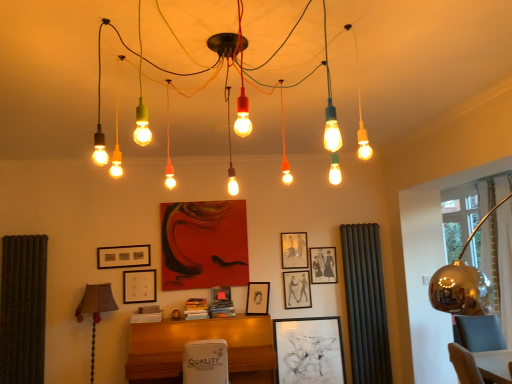
Question: Is the depth of matte black picture frame at center, positioned as the third picture frame in right-to-left order, greater than that of matte black picture frame at center, which ranks as the 5th picture frame in left-to-right order?

Choices:
 (A) yes
 (B) no

Answer: (A)

Question: Would you say matte black picture frame at center, which ranks as the 5th picture frame in left-to-right order, is part of matte black picture frame at center, the 7th picture frame from the left,'s contents?

Choices:
 (A) yes
 (B) no

Answer: (B)

Question: Would you say matte black picture frame at center, positioned as the third picture frame in right-to-left order, is a long distance from matte black picture frame at center, which ranks as the 5th picture frame in left-to-right order?

Choices:
 (A) no
 (B) yes

Answer: (A)

Question: Does matte black picture frame at center, the 7th picture frame from the left, touch matte black picture frame at center, which ranks as the 5th picture frame in left-to-right order?

Choices:
 (A) yes
 (B) no

Answer: (B)

Question: From a real-world perspective, is matte black picture frame at center, the 7th picture frame from the left, physically above matte black picture frame at center, the 5th picture frame positioned from the right?

Choices:
 (A) no
 (B) yes

Answer: (B)

Question: Considering the relative sizes of matte black picture frame at center, the 7th picture frame from the left, and matte black picture frame at center, which ranks as the 5th picture frame in left-to-right order, in the image provided, is matte black picture frame at center, the 7th picture frame from the left, thinner than matte black picture frame at center, which ranks as the 5th picture frame in left-to-right order,?

Choices:
 (A) no
 (B) yes

Answer: (B)

Question: From a real-world perspective, is matte black picture frame at upper center, the 4th picture frame viewed from the right, over black matte picture frame at upper left, the 1th picture frame when ordered from left to right?

Choices:
 (A) yes
 (B) no

Answer: (B)

Question: From the image's perspective, is matte black picture frame at upper center, arranged as the 6th picture frame when viewed from the left, above black matte picture frame at upper left, the 1th picture frame when ordered from left to right?

Choices:
 (A) yes
 (B) no

Answer: (A)

Question: From the image's perspective, is matte black picture frame at upper center, arranged as the 6th picture frame when viewed from the left, beneath black matte picture frame at upper left, the 9th picture frame from the right?

Choices:
 (A) no
 (B) yes

Answer: (A)

Question: Is matte black picture frame at upper center, arranged as the 6th picture frame when viewed from the left, outside black matte picture frame at upper left, the 1th picture frame when ordered from left to right?

Choices:
 (A) yes
 (B) no

Answer: (A)

Question: Considering the relative sizes of matte black picture frame at upper center, the 4th picture frame viewed from the right, and black matte picture frame at upper left, the 9th picture frame from the right, in the image provided, is matte black picture frame at upper center, the 4th picture frame viewed from the right, taller than black matte picture frame at upper left, the 9th picture frame from the right,?

Choices:
 (A) yes
 (B) no

Answer: (A)

Question: From the image's perspective, would you say black matte picture frame at center, which ranks as the 2th picture frame in right-to-left order, is positioned over matte black picture frame at center, the 1th picture frame from the right?

Choices:
 (A) no
 (B) yes

Answer: (A)